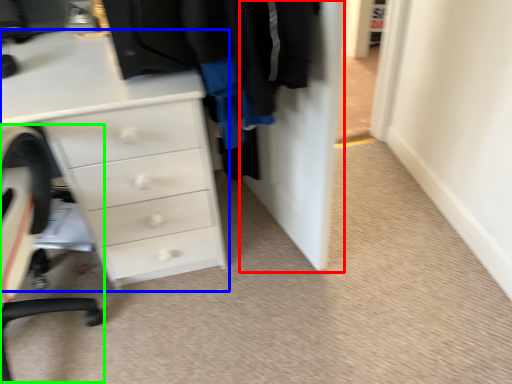
Question: Which is nearer to the door (highlighted by a red box)? chest of drawers (highlighted by a blue box) or computer chair (highlighted by a green box).

Choices:
 (A) chest of drawers
 (B) computer chair

Answer: (A)